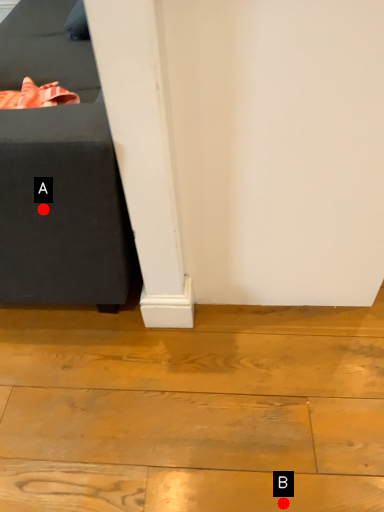
Question: Two points are circled on the image, labeled by A and B beside each circle. Among these points, which one is nearest to the camera?

Choices:
 (A) A is closer
 (B) B is closer

Answer: (B)